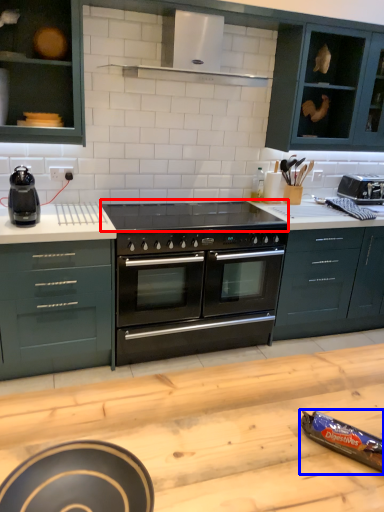
Question: Among these objects, which one is nearest to the camera, gas stove (highlighted by a red box) or appliance (highlighted by a blue box)?

Choices:
 (A) gas stove
 (B) appliance

Answer: (B)